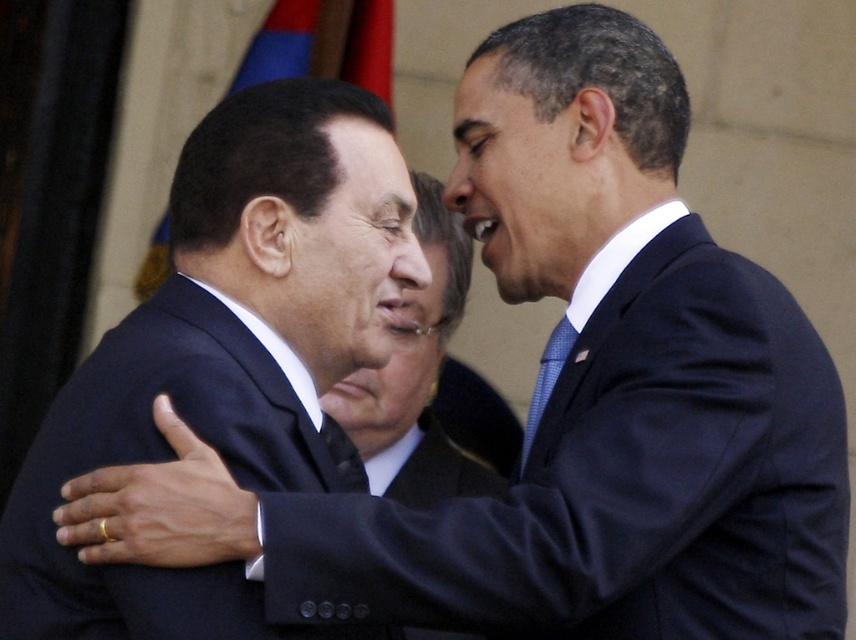
Question: Which point is closer to the camera taking this photo?

Choices:
 (A) (366, 465)
 (B) (551, 385)
 (C) (209, 326)

Answer: (C)

Question: Can you confirm if dark blue suit at left is bigger than matte black suit at center?

Choices:
 (A) no
 (B) yes

Answer: (A)

Question: Estimate the real-world distances between objects in this image. Which object is closer to the dark blue suit at left?

Choices:
 (A) blue textured tie at right
 (B) matte black suit at center

Answer: (A)

Question: Which point is farther from the camera taking this photo?

Choices:
 (A) (424, 305)
 (B) (557, 360)
 (C) (230, 372)

Answer: (A)

Question: In this image, where is dark blue suit at left located relative to blue textured tie at right?

Choices:
 (A) below
 (B) above

Answer: (A)

Question: Can you confirm if dark blue suit at left is wider than matte black suit at center?

Choices:
 (A) no
 (B) yes

Answer: (B)